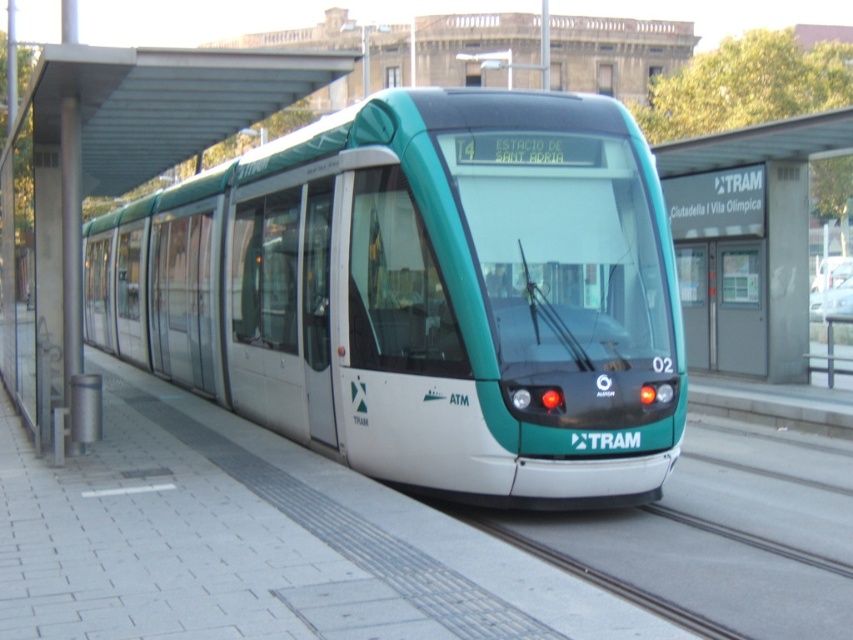
Question: Is green matte tram at center positioned before metallic silver bus stop at center?

Choices:
 (A) no
 (B) yes

Answer: (B)

Question: Is green matte tram at center below metallic silver bus stop at center?

Choices:
 (A) no
 (B) yes

Answer: (B)

Question: Can you confirm if green matte tram at center is positioned to the left of metallic silver bus stop at center?

Choices:
 (A) yes
 (B) no

Answer: (B)

Question: Which point is farther to the camera?

Choices:
 (A) green matte tram at center
 (B) metallic silver bus stop at center

Answer: (B)

Question: Which point is farther from the camera taking this photo?

Choices:
 (A) (222, 93)
 (B) (448, 392)

Answer: (A)